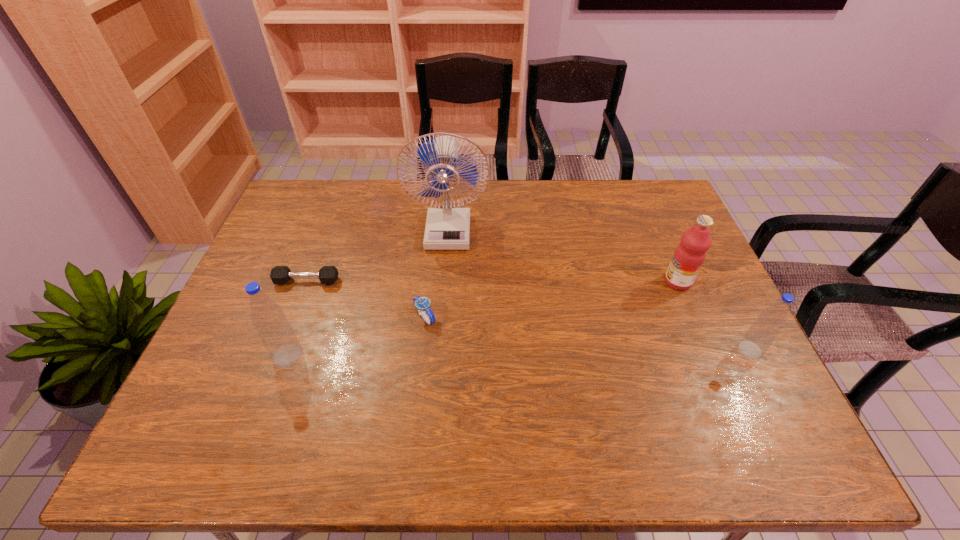
I want to click on the taller water bottle, so click(275, 332).

You are a GUI agent. You are given a task and a screenshot of the screen. Output one action in this format:
    pyautogui.click(x=<x>, y=<y>)
    Task: Click on the rightmost object
    
    Given the screenshot: What is the action you would take?
    pyautogui.click(x=761, y=334)

Locate an element on the screen. This screenshot has height=540, width=960. the shorter water bottle is located at coordinates (761, 334).

Locate an element on the screen. the second object from right to left is located at coordinates (690, 254).

Image resolution: width=960 pixels, height=540 pixels. What are the coordinates of `watch` in the screenshot? It's located at (423, 305).

In order to click on dumbbell in this screenshot , I will do `click(280, 274)`.

At what (x,y) coordinates should I click in order to perform the action: click on the farthest object. Please return your answer as a coordinate pair (x, y). Looking at the image, I should click on (448, 227).

Where is `fan`? The image size is (960, 540). fan is located at coordinates [448, 227].

Find the location of a particular element. The height and width of the screenshot is (540, 960). vacant space situated 0.220m on the back of the taller water bottle is located at coordinates (315, 280).

You are a GUI agent. You are given a task and a screenshot of the screen. Output one action in this format:
    pyautogui.click(x=<x>, y=<y>)
    Task: Click on the vacant region located on the left of the right water bottle
    
    Given the screenshot: What is the action you would take?
    pyautogui.click(x=659, y=350)